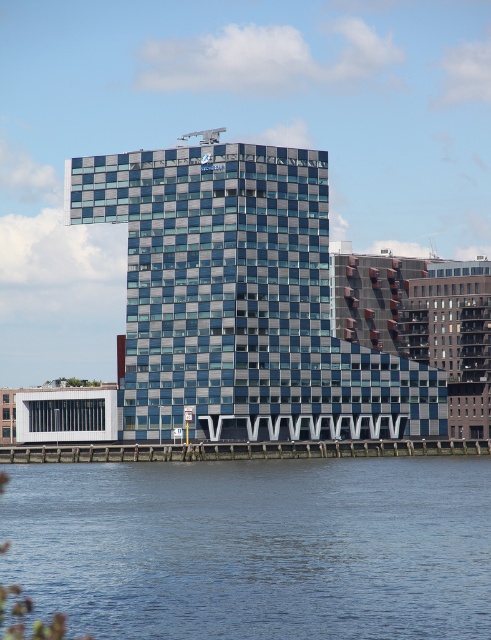
Question: Which object is farther from the camera taking this photo?

Choices:
 (A) blue glass building at center
 (B) blue water at lower center

Answer: (A)

Question: Is blue water at lower center above blue glass building at center?

Choices:
 (A) yes
 (B) no

Answer: (B)

Question: Which of the following is the closest to the observer?

Choices:
 (A) blue glass building at center
 (B) blue water at lower center

Answer: (B)

Question: Is blue water at lower center to the right of blue glass building at center from the viewer's perspective?

Choices:
 (A) no
 (B) yes

Answer: (B)

Question: Observing the image, what is the correct spatial positioning of blue water at lower center in reference to blue glass building at center?

Choices:
 (A) left
 (B) right

Answer: (B)